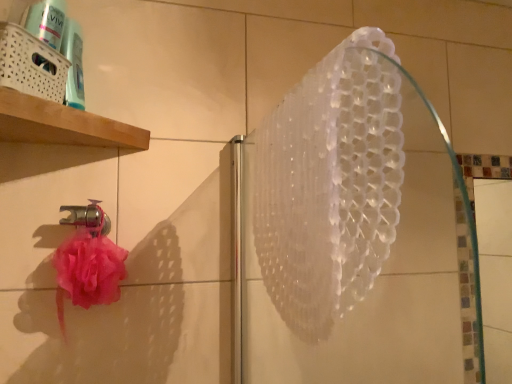
Locate an element on the screen. white woven basket at upper left is located at coordinates (62, 124).

The image size is (512, 384). What do you see at coordinates (62, 124) in the screenshot?
I see `white woven basket at upper left` at bounding box center [62, 124].

Measure the distance between metallic silver faucet at lower left and camera.

metallic silver faucet at lower left is 33.77 inches from camera.

The height and width of the screenshot is (384, 512). Describe the element at coordinates (88, 218) in the screenshot. I see `metallic silver faucet at lower left` at that location.

Locate an element on the screen. Image resolution: width=512 pixels, height=384 pixels. white woven basket at upper left is located at coordinates (62, 124).

Measure the distance between white woven basket at upper left and transparent plastic shower at upper center.

white woven basket at upper left and transparent plastic shower at upper center are 19.18 inches apart.

Is point (7, 126) behind point (292, 189)?

Yes, it is behind point (292, 189).

Do you think white woven basket at upper left is within transparent plastic shower at upper center, or outside of it?

white woven basket at upper left is not enclosed by transparent plastic shower at upper center.

Is white woven basket at upper left oriented towards transparent plastic shower at upper center?

No.

Considering the relative positions of metallic silver faucet at lower left and white woven basket at upper left in the image provided, is metallic silver faucet at lower left to the left of white woven basket at upper left from the viewer's perspective?

Correct, you'll find metallic silver faucet at lower left to the left of white woven basket at upper left.

You are a GUI agent. You are given a task and a screenshot of the screen. Output one action in this format:
    pyautogui.click(x=<x>, y=<y>)
    Task: Click on the shelf above the metallic silver faucet at lower left (from a real-world perspective)
    The width and height of the screenshot is (512, 384).
    Given the screenshot: What is the action you would take?
    pyautogui.click(x=62, y=124)

From the image's perspective, is metallic silver faucet at lower left positioned above or below white woven basket at upper left?

Based on their image positions, metallic silver faucet at lower left is located beneath white woven basket at upper left.

How different are the orientations of metallic silver faucet at lower left and transparent plastic shower at upper center in degrees?

83 degrees.

Identify the location of shower above the metallic silver faucet at lower left (from a real-world perspective). This screenshot has width=512, height=384. (330, 184).

In the image, is metallic silver faucet at lower left positioned in front of or behind transparent plastic shower at upper center?

In the image, metallic silver faucet at lower left appears behind transparent plastic shower at upper center.

Is point (99, 212) closer to camera compared to point (326, 139)?

No.

Is transparent plastic shower at upper center taller than white woven basket at upper left?

Correct, transparent plastic shower at upper center is much taller as white woven basket at upper left.

Could you tell me if transparent plastic shower at upper center is turned towards white woven basket at upper left?

No, transparent plastic shower at upper center is not facing towards white woven basket at upper left.

At what (x,y) coordinates should I click in order to perform the action: click on shower below the white woven basket at upper left (from a real-world perspective). Please return your answer as a coordinate pair (x, y). The width and height of the screenshot is (512, 384). Looking at the image, I should click on (330, 184).

Considering the points (401, 184) and (81, 113), which point is behind, point (401, 184) or point (81, 113)?

The point (81, 113) is farther from the camera.

Considering the points (3, 129) and (78, 222), which point is in front, point (3, 129) or point (78, 222)?

The point (3, 129) is closer to the camera.

How many degrees apart are the facing directions of white woven basket at upper left and metallic silver faucet at lower left?

There is a 6.76-degree angle between the facing directions of white woven basket at upper left and metallic silver faucet at lower left.

Is white woven basket at upper left spatially inside metallic silver faucet at lower left, or outside of it?

white woven basket at upper left is not inside metallic silver faucet at lower left, it's outside.

Which object is wider, white woven basket at upper left or metallic silver faucet at lower left?

white woven basket at upper left.

In the image, is transparent plastic shower at upper center positioned in front of or behind metallic silver faucet at lower left?

In the image, transparent plastic shower at upper center appears in front of metallic silver faucet at lower left.

From a real-world perspective, who is located higher, transparent plastic shower at upper center or metallic silver faucet at lower left?

transparent plastic shower at upper center.

Consider the image. Does transparent plastic shower at upper center have a lesser height compared to metallic silver faucet at lower left?

In fact, transparent plastic shower at upper center may be taller than metallic silver faucet at lower left.

Is transparent plastic shower at upper center oriented towards metallic silver faucet at lower left?

No.

You are a GUI agent. You are given a task and a screenshot of the screen. Output one action in this format:
    pyautogui.click(x=<x>, y=<y>)
    Task: Click on the shelf above the transparent plastic shower at upper center (from the image's perspective)
    This screenshot has height=384, width=512.
    Given the screenshot: What is the action you would take?
    pyautogui.click(x=62, y=124)

You are a GUI agent. You are given a task and a screenshot of the screen. Output one action in this format:
    pyautogui.click(x=<x>, y=<y>)
    Task: Click on the shelf above the metallic silver faucet at lower left (from a real-world perspective)
    This screenshot has width=512, height=384.
    Given the screenshot: What is the action you would take?
    pyautogui.click(x=62, y=124)

From the image, which object appears to be nearer to transparent plastic shower at upper center, metallic silver faucet at lower left or white woven basket at upper left?

white woven basket at upper left is positioned closer to the anchor transparent plastic shower at upper center.

Estimate the real-world distances between objects in this image. Which object is closer to white woven basket at upper left, metallic silver faucet at lower left or transparent plastic shower at upper center?

The object closer to white woven basket at upper left is metallic silver faucet at lower left.

Which object lies further to the anchor point white woven basket at upper left, transparent plastic shower at upper center or metallic silver faucet at lower left?

transparent plastic shower at upper center lies further to white woven basket at upper left than the other object.

Looking at the image, which one is located further to metallic silver faucet at lower left, transparent plastic shower at upper center or white woven basket at upper left?

The object further to metallic silver faucet at lower left is transparent plastic shower at upper center.

When comparing their distances from transparent plastic shower at upper center, does white woven basket at upper left or metallic silver faucet at lower left seem closer?

white woven basket at upper left.

Which object lies nearer to the anchor point metallic silver faucet at lower left, white woven basket at upper left or transparent plastic shower at upper center?

Among the two, white woven basket at upper left is located nearer to metallic silver faucet at lower left.

The height and width of the screenshot is (384, 512). I want to click on shelf positioned between transparent plastic shower at upper center and metallic silver faucet at lower left from near to far, so click(x=62, y=124).